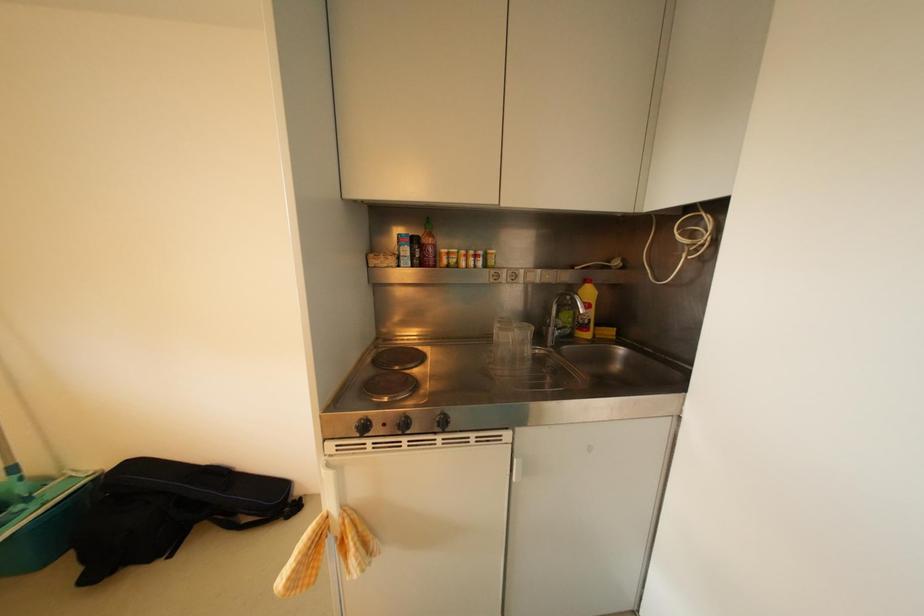
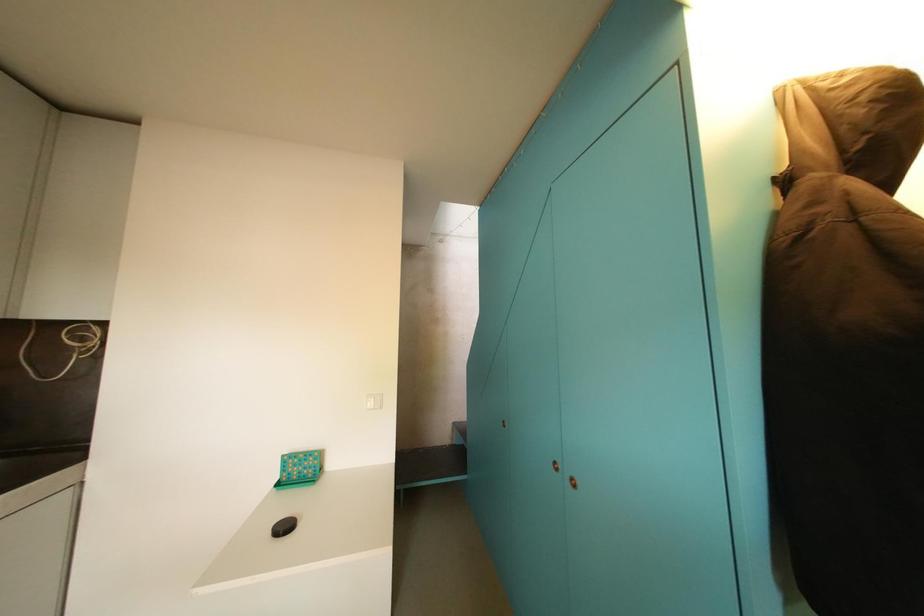
Question: How did the camera likely rotate?

Choices:
 (A) Left
 (B) Right
 (C) Up
 (D) Down

Answer: (B)